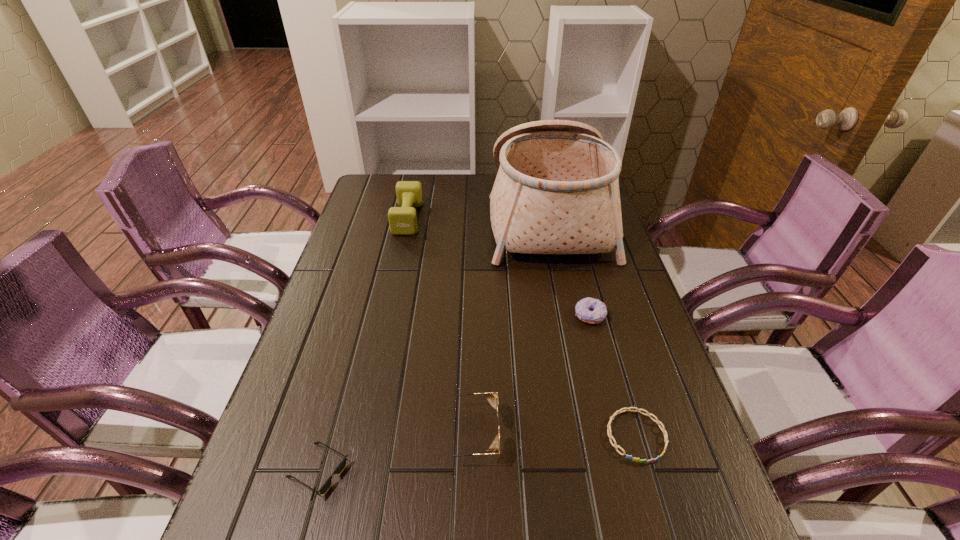
Where is `basket`? basket is located at coordinates (557, 190).

The width and height of the screenshot is (960, 540). I want to click on the second tallest object, so click(402, 220).

The image size is (960, 540). I want to click on the third tallest object, so click(x=491, y=397).

Find the location of a particular element. The height and width of the screenshot is (540, 960). the right sunglasses is located at coordinates (491, 397).

Where is `the fourth nearest object`? the fourth nearest object is located at coordinates (598, 312).

You are a GUI agent. You are given a task and a screenshot of the screen. Output one action in this format:
    pyautogui.click(x=<x>, y=<y>)
    Task: Click on the third shortest object
    
    Given the screenshot: What is the action you would take?
    pyautogui.click(x=598, y=312)

At what (x,y) coordinates should I click in order to perform the action: click on the fifth tallest object. Please return your answer as a coordinate pair (x, y). The image size is (960, 540). Looking at the image, I should click on (342, 465).

The height and width of the screenshot is (540, 960). I want to click on the shorter sunglasses, so click(342, 465).

Image resolution: width=960 pixels, height=540 pixels. I want to click on bracelet, so click(x=657, y=421).

I want to click on vacant space located with the lid open on the tallest object, so click(430, 215).